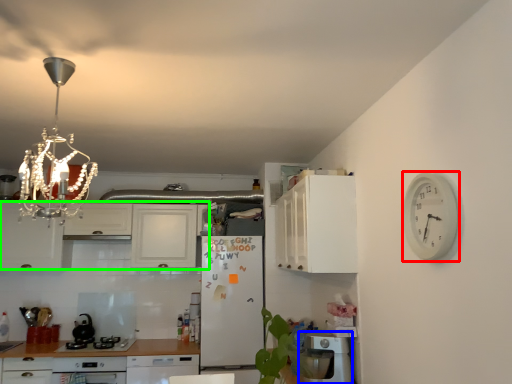
Question: Based on their relative distances, which object is farther from clock (highlighted by a red box)? Choose from dish washer (highlighted by a blue box) and cabinetry (highlighted by a green box).

Choices:
 (A) dish washer
 (B) cabinetry

Answer: (B)